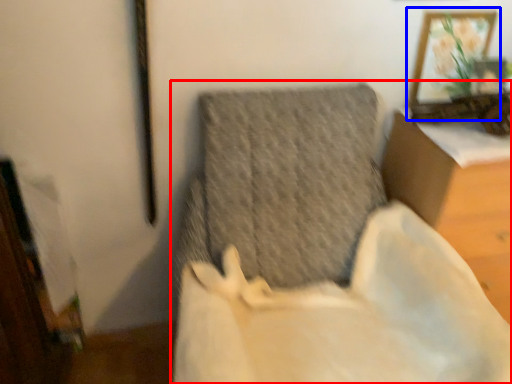
Question: Which of the following is the farthest to the observer, furniture (highlighted by a red box) or picture frame (highlighted by a blue box)?

Choices:
 (A) furniture
 (B) picture frame

Answer: (B)